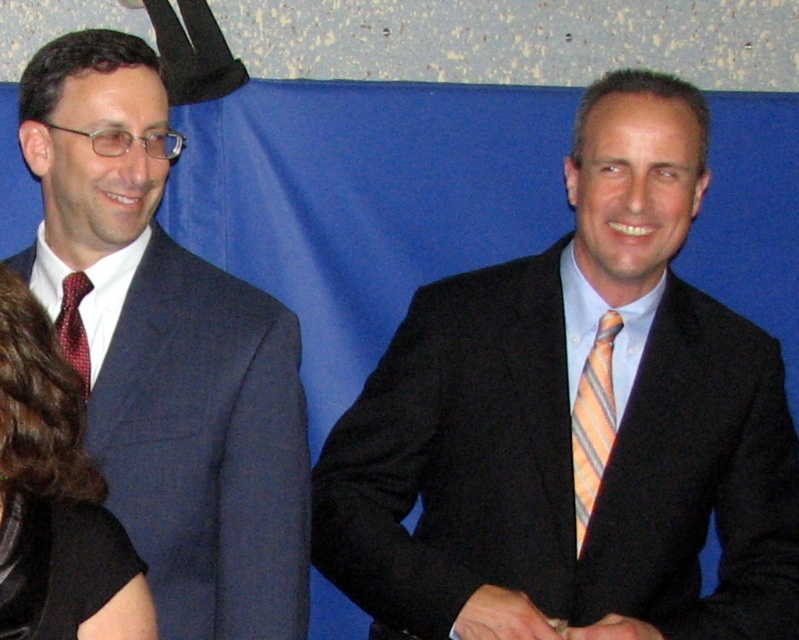
The width and height of the screenshot is (799, 640). What do you see at coordinates (593, 420) in the screenshot?
I see `orange striped tie at right` at bounding box center [593, 420].

Which is more to the right, orange striped tie at right or red dotted silk tie at left?

Positioned to the right is orange striped tie at right.

Between point (575, 520) and point (64, 296), which one is positioned behind?

The point (64, 296) is more distant.

The width and height of the screenshot is (799, 640). In order to click on orange striped tie at right in this screenshot , I will do `click(593, 420)`.

How much distance is there between shiny black hair at left and orange striped tie at right?

shiny black hair at left is 25.58 inches from orange striped tie at right.

From the picture: Is shiny black hair at left above orange striped tie at right?

Incorrect, shiny black hair at left is not positioned above orange striped tie at right.

Between point (6, 502) and point (583, 435), which one is positioned behind?

Point (583, 435)

Identify the location of shiny black hair at left. The height and width of the screenshot is (640, 799). (62, 480).

Which of these two, matte black suit at left or orange striped tie at right, stands shorter?

With less height is orange striped tie at right.

Based on the photo, does matte black suit at left have a smaller size compared to orange striped tie at right?

Incorrect, matte black suit at left is not smaller in size than orange striped tie at right.

Between point (287, 358) and point (594, 342), which one is positioned behind?

Point (287, 358)

At what (x,y) coordinates should I click in order to perform the action: click on matte black suit at left. Please return your answer as a coordinate pair (x, y). Looking at the image, I should click on [x=169, y=352].